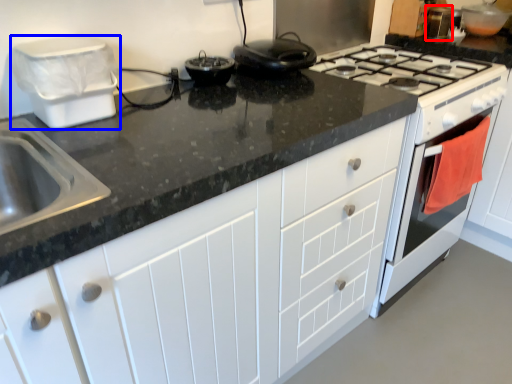
Question: Which object appears closest to the camera in this image, appliance (highlighted by a red box) or appliance (highlighted by a blue box)?

Choices:
 (A) appliance
 (B) appliance

Answer: (B)